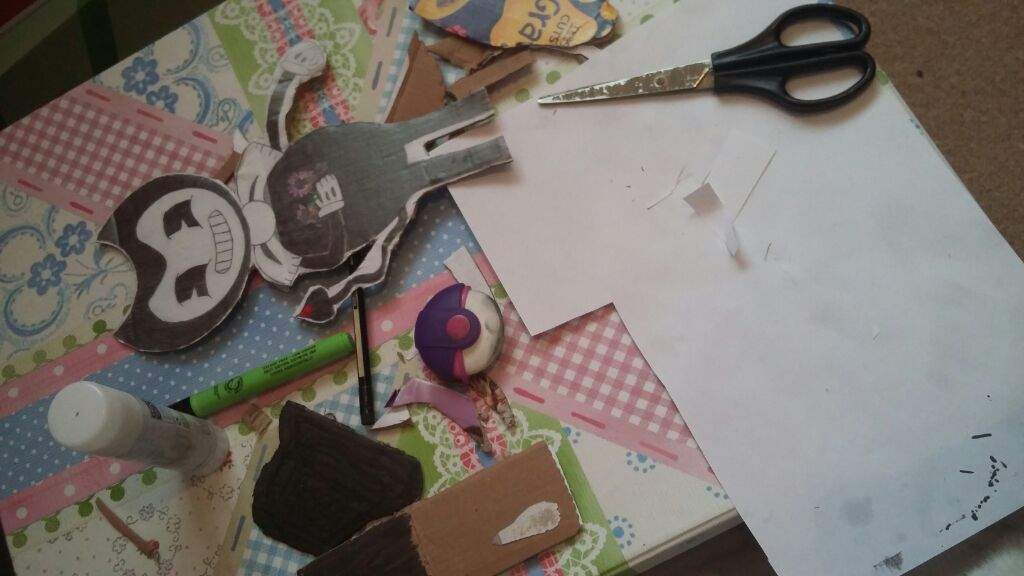
The image size is (1024, 576). I want to click on bottle, so click(x=172, y=444).